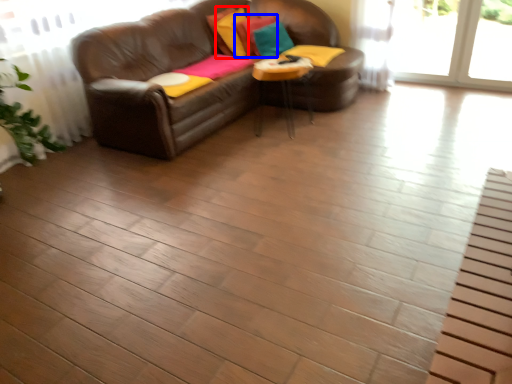
Question: Among these objects, which one is farthest to the camera, pillow (highlighted by a red box) or pillow (highlighted by a blue box)?

Choices:
 (A) pillow
 (B) pillow

Answer: (B)